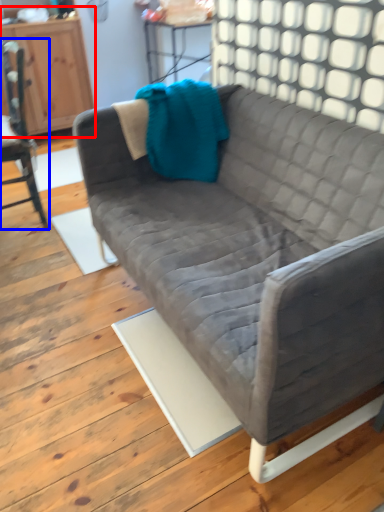
Question: Which point is further to the camera, dresser (highlighted by a red box) or chair (highlighted by a blue box)?

Choices:
 (A) dresser
 (B) chair

Answer: (A)